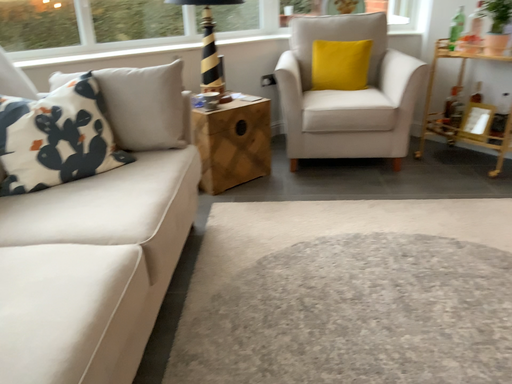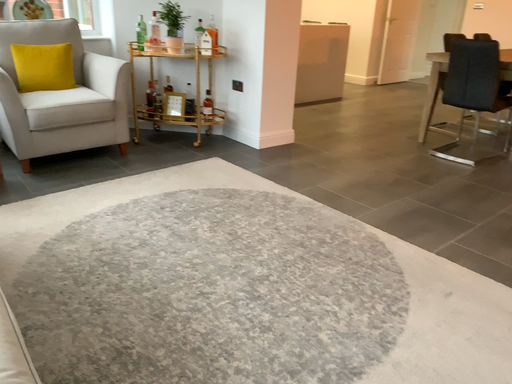
Question: How did the camera likely rotate when shooting the video?

Choices:
 (A) rotated upward
 (B) rotated downward

Answer: (A)